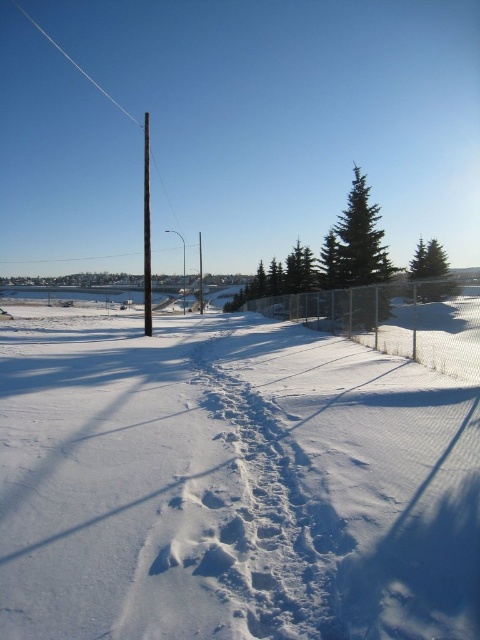
Question: Which object is the farthest from the white powdery snow at center?

Choices:
 (A) white wire at upper center
 (B) green textured pine at upper center

Answer: (A)

Question: Estimate the real-world distances between objects in this image. Which object is farther from the brown wooden telegraph pole at center-left?

Choices:
 (A) white powdery snow at center
 (B) smooth black pole at center
 (C) green textured pine at upper center
 (D) white wire at upper center

Answer: (D)

Question: Can you confirm if white powdery snow at center is positioned below smooth black pole at center?

Choices:
 (A) yes
 (B) no

Answer: (A)

Question: Which point is farther from the camera taking this photo?

Choices:
 (A) (52, 38)
 (B) (362, 444)
 (C) (365, 272)

Answer: (A)

Question: Where is smooth black pole at center located in relation to brown wooden telegraph pole at center-left in the image?

Choices:
 (A) left
 (B) right

Answer: (A)

Question: Is smooth black pole at center thinner than white wire at upper center?

Choices:
 (A) yes
 (B) no

Answer: (A)